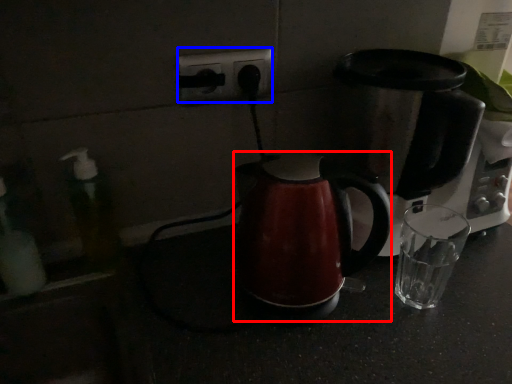
Question: Which point is closer to the camera, kettle (highlighted by a red box) or electric outlet (highlighted by a blue box)?

Choices:
 (A) kettle
 (B) electric outlet

Answer: (A)